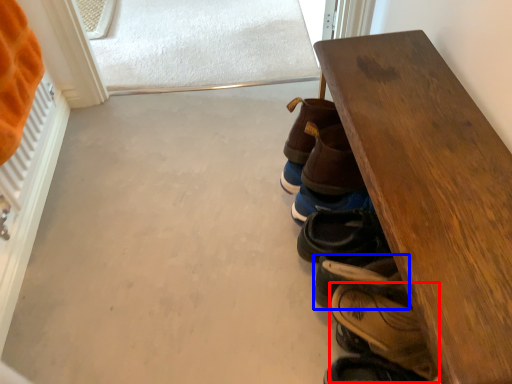
Question: Which point is closer to the camera, footwear (highlighted by a red box) or footwear (highlighted by a blue box)?

Choices:
 (A) footwear
 (B) footwear

Answer: (B)